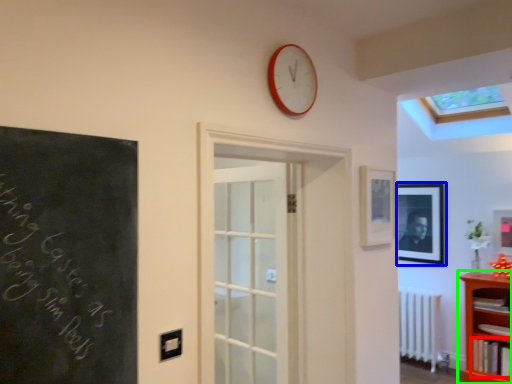
Question: Which object is the farthest from book (highlighted by a red box)? Choose among these: picture frame (highlighted by a blue box) or shelf (highlighted by a green box).

Choices:
 (A) picture frame
 (B) shelf

Answer: (A)